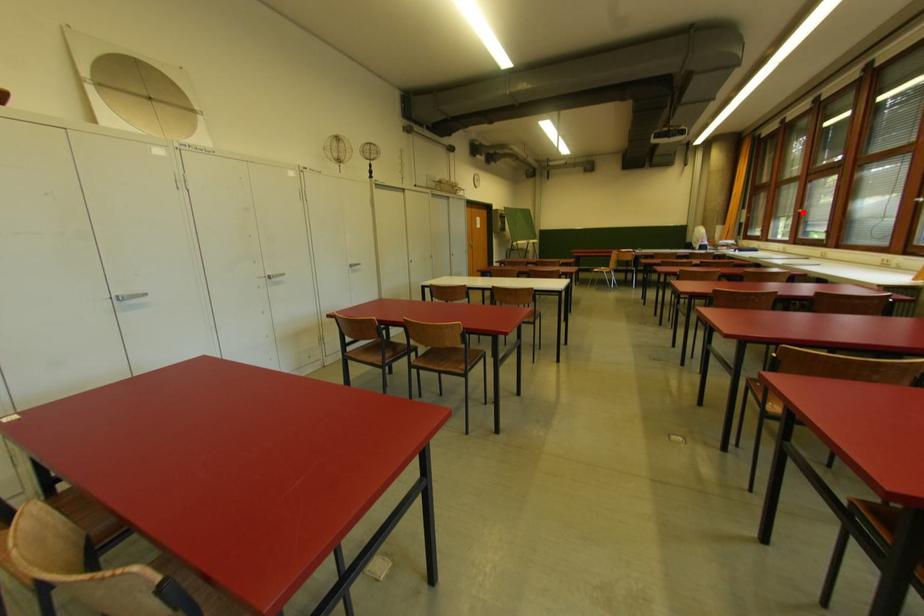
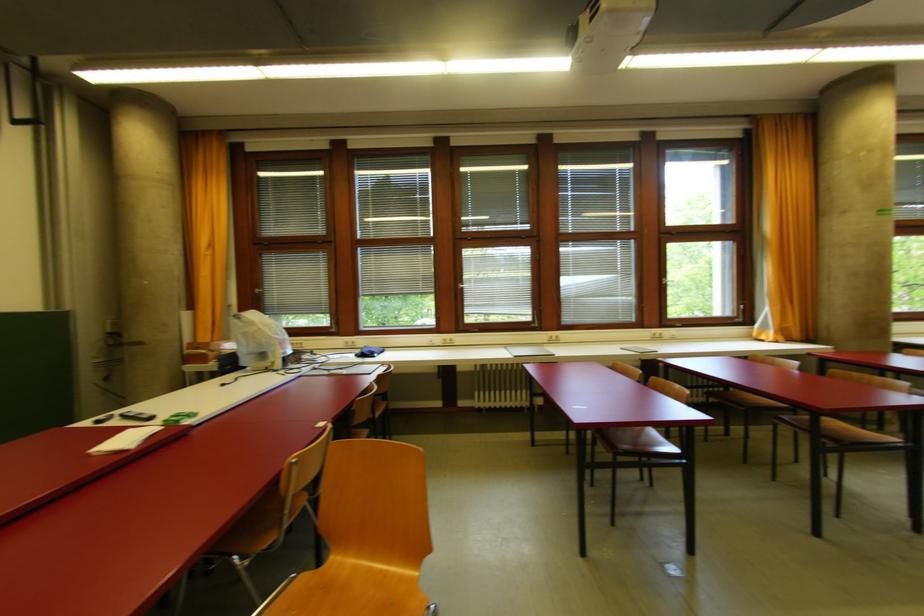
Question: I am providing you with two images of the same scene from different viewpoints. Given a red point in image1, look at the same physical point in image2. Is it:

Choices:
 (A) Closer to the viewpoint
 (B) Farther from the viewpoint

Answer: (A)